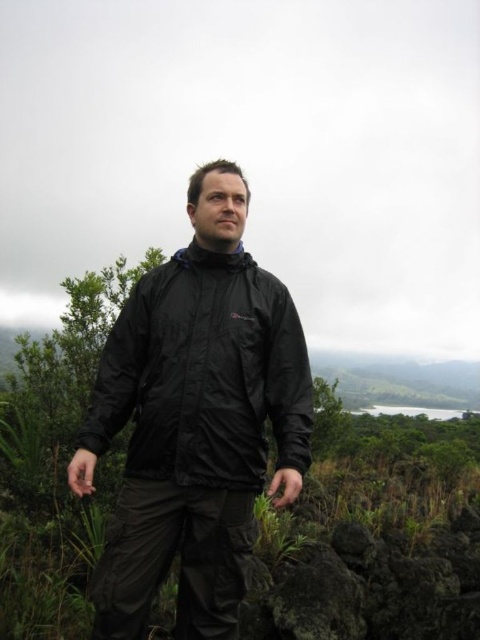
Looking at this image, between green matte plant at center and black waterproof jacket at center, which one appears on the right side from the viewer's perspective?

Positioned to the right is green matte plant at center.

Can you confirm if green matte plant at center is shorter than black waterproof jacket at center?

No, green matte plant at center is not shorter than black waterproof jacket at center.

What are the coordinates of `green matte plant at center` in the screenshot? It's located at (375, 531).

I want to click on green matte plant at center, so click(375, 531).

From the picture: Between black waterproof jacket at center and dark gray rough rock at lower center, which one appears on the right side from the viewer's perspective?

dark gray rough rock at lower center

Who is more distant from viewer, [164,339] or [354,580]?

The point [354,580] is behind.

In order to click on black waterproof jacket at center in this screenshot , I will do `click(204, 374)`.

Does green matte plant at center have a lesser width compared to dark gray rough rock at lower center?

No.

Is green matte plant at center positioned at the back of dark gray rough rock at lower center?

No.

This screenshot has height=640, width=480. Identify the location of green matte plant at center. (375, 531).

Where is `green matte plant at center`? The image size is (480, 640). green matte plant at center is located at coordinates (375, 531).